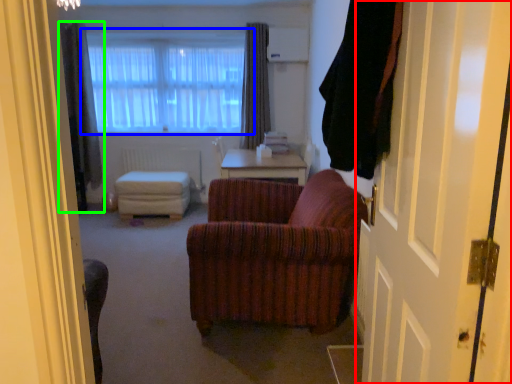
Question: Estimate the real-world distances between objects in this image. Which object is farther from door (highlighted by a red box), window (highlighted by a blue box) or curtain (highlighted by a green box)?

Choices:
 (A) window
 (B) curtain

Answer: (B)